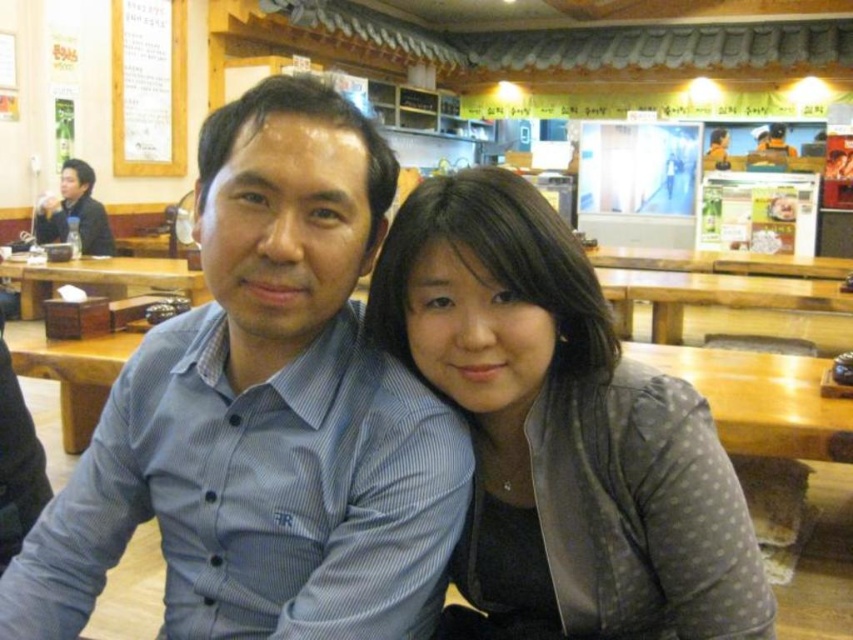
Question: Can you confirm if wooden table at center is thinner than matte black jacket at upper left?

Choices:
 (A) no
 (B) yes

Answer: (A)

Question: Does blue striped shirt at center appear over wooden table at center?

Choices:
 (A) no
 (B) yes

Answer: (A)

Question: Among these points, which one is nearest to the camera?

Choices:
 (A) (726, 556)
 (B) (306, 579)

Answer: (A)

Question: Can you confirm if gray dotted jacket at center is smaller than matte black jacket at upper left?

Choices:
 (A) yes
 (B) no

Answer: (A)

Question: Which point is farther to the camera?

Choices:
 (A) gray dotted jacket at center
 (B) blue striped shirt at center

Answer: (A)

Question: Which object appears farthest from the camera in this image?

Choices:
 (A) wooden table at center
 (B) gray dotted jacket at center

Answer: (A)